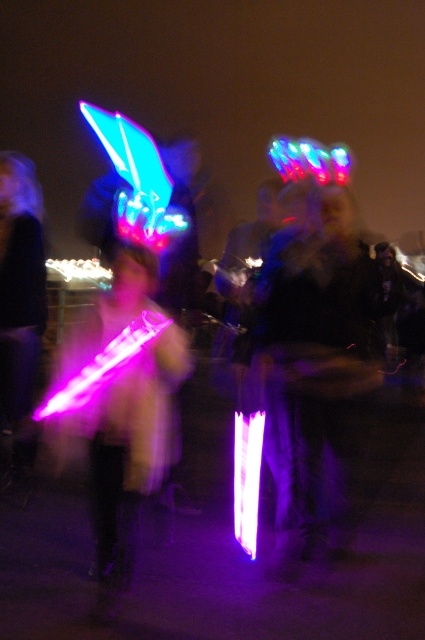
Question: Which object appears closest to the camera in this image?

Choices:
 (A) neon plastic light stick at center
 (B) glowing plastic sword at center

Answer: (B)

Question: Is neon plastic light stick at center below glowing plastic sword at center?

Choices:
 (A) yes
 (B) no

Answer: (B)

Question: Is neon plastic light stick at center wider than glowing plastic sword at center?

Choices:
 (A) no
 (B) yes

Answer: (B)

Question: Which point is closer to the camera?

Choices:
 (A) (291, 262)
 (B) (57, 372)

Answer: (A)

Question: Can you confirm if neon plastic light stick at center is thinner than glowing plastic sword at center?

Choices:
 (A) yes
 (B) no

Answer: (B)